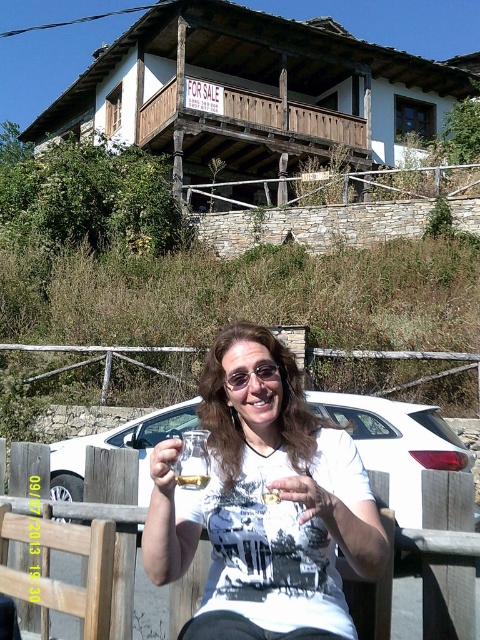
You are a photographer taking a picture of the clear glass wine glass at center and the translucent glass at center. Which glass should you focus on first if you want to capture both in sharp focus?

The clear glass wine glass at center is above the translucent glass at center, so focusing on the clear glass wine glass at center first would ensure both are in focus as the translucent glass is below it.

You are a bartender preparing drinks for a customer who is sitting outside a rustic house. You have two glasses in front of you, the clear glass wine glass at center and the translucent glass at center. The customer asks which glass is closer to the left side of the table. Which one do you tell them?

The clear glass wine glass at center is to the left of the translucent glass at center, so it is closer to the left side of the table.